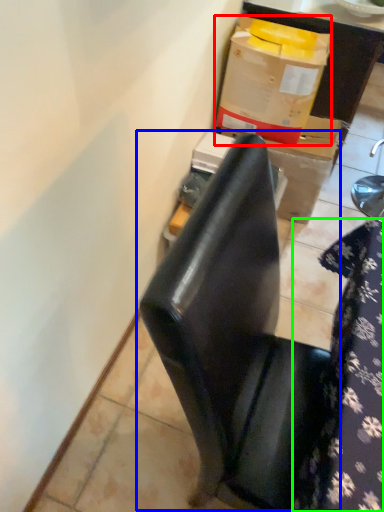
Question: Considering the real-world distances, which object is farthest from box (highlighted by a red box)? chair (highlighted by a blue box) or tablecloth (highlighted by a green box)?

Choices:
 (A) chair
 (B) tablecloth

Answer: (A)